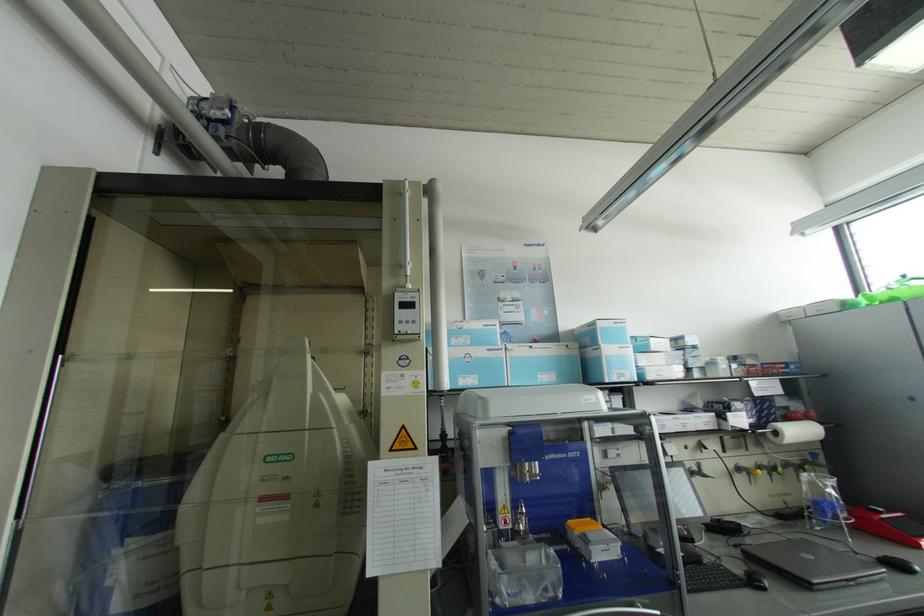
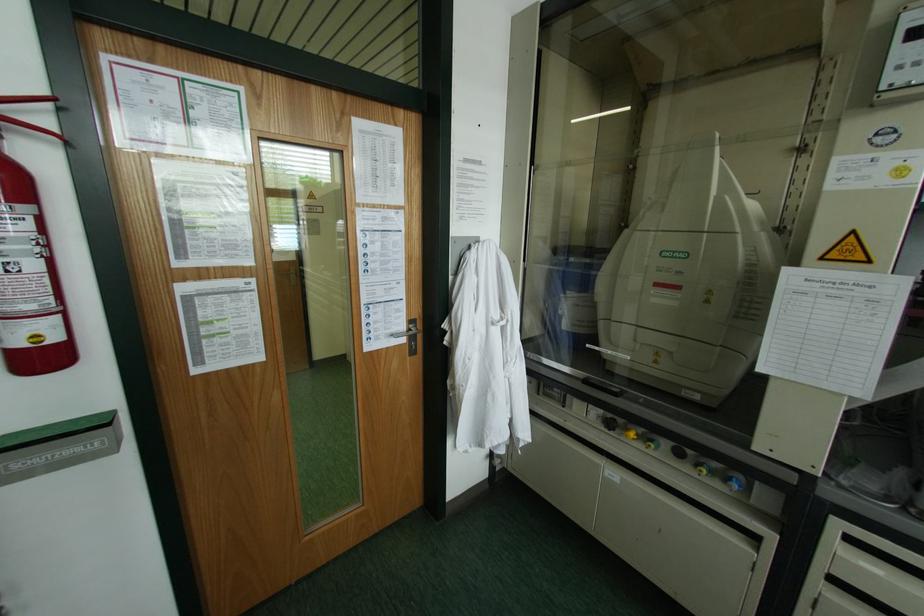
Where in the second image is the point corresponding to point 347,504 from the first image?

(743, 310)